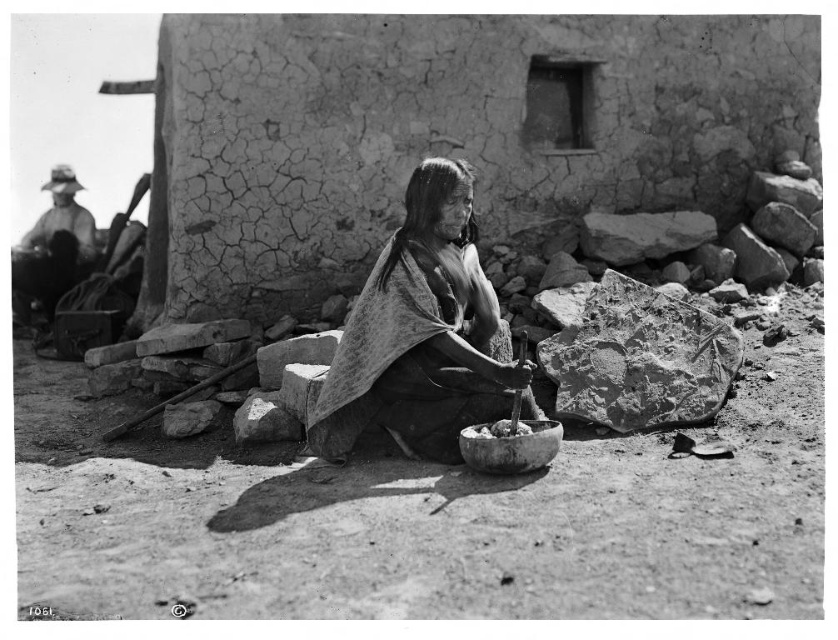
Who is lower down, smooth clay bowl at center or smooth white stones at center?

smooth clay bowl at center is lower down.

Who is more forward, (x=505, y=452) or (x=485, y=422)?

Point (x=505, y=452) is more forward.

This screenshot has width=838, height=640. Find the location of `smooth clay bowl at center`. smooth clay bowl at center is located at coordinates click(x=510, y=445).

This screenshot has height=640, width=838. Describe the element at coordinates (53, 246) in the screenshot. I see `rugged fabric hat at left` at that location.

From the picture: Does rugged fabric hat at left appear on the left side of smooth clay bowl at center?

Correct, you'll find rugged fabric hat at left to the left of smooth clay bowl at center.

Which is in front, point (19, 244) or point (490, 429)?

Point (490, 429) is more forward.

I want to click on rugged fabric hat at left, so click(53, 246).

Does smooth fabric shawl at center have a greater width compared to rugged fabric hat at left?

No.

Between smooth fabric shawl at center and rugged fabric hat at left, which one has more height?

rugged fabric hat at left

Between point (469, 394) and point (65, 273), which one is positioned behind?

Positioned behind is point (65, 273).

Where is `smooth fabric shawl at center`? The image size is (838, 640). smooth fabric shawl at center is located at coordinates (422, 333).